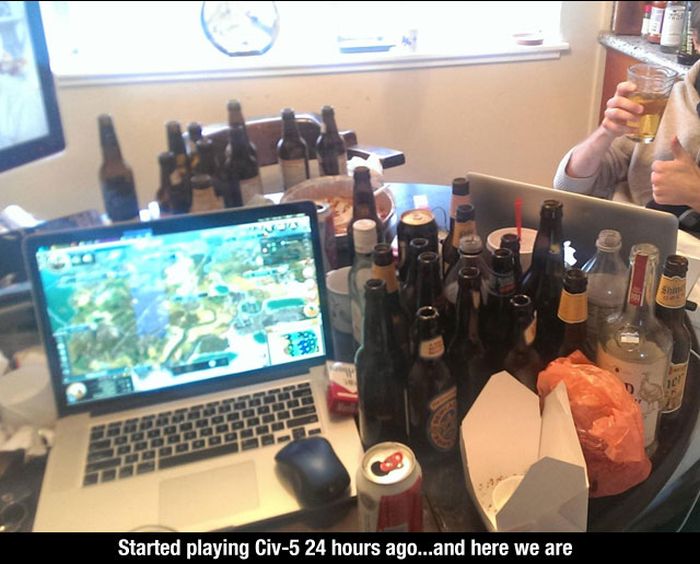
At what (x,y) coordinates should I click in order to perform the action: click on laptop computer. Please return your answer as a coordinate pair (x, y). Looking at the image, I should click on (52, 444).